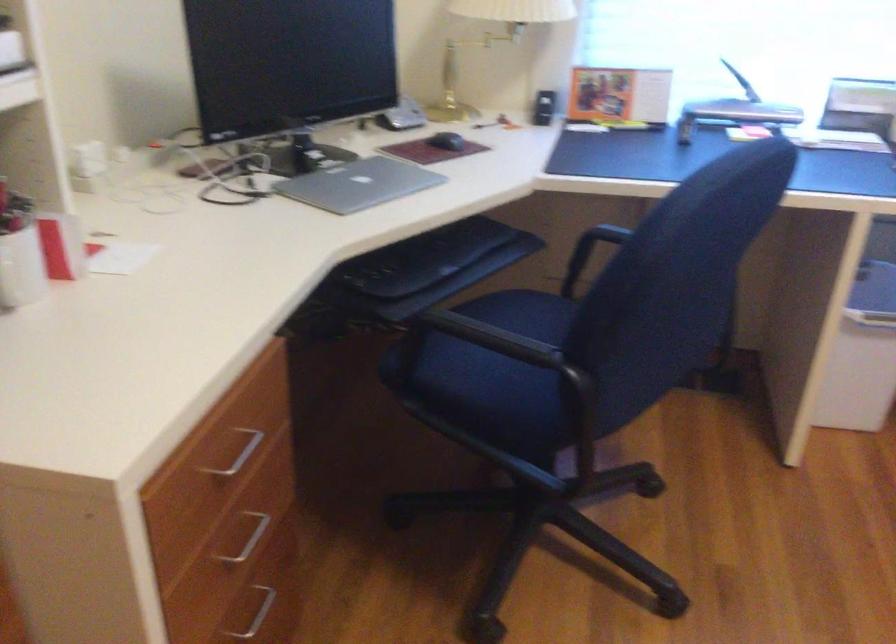
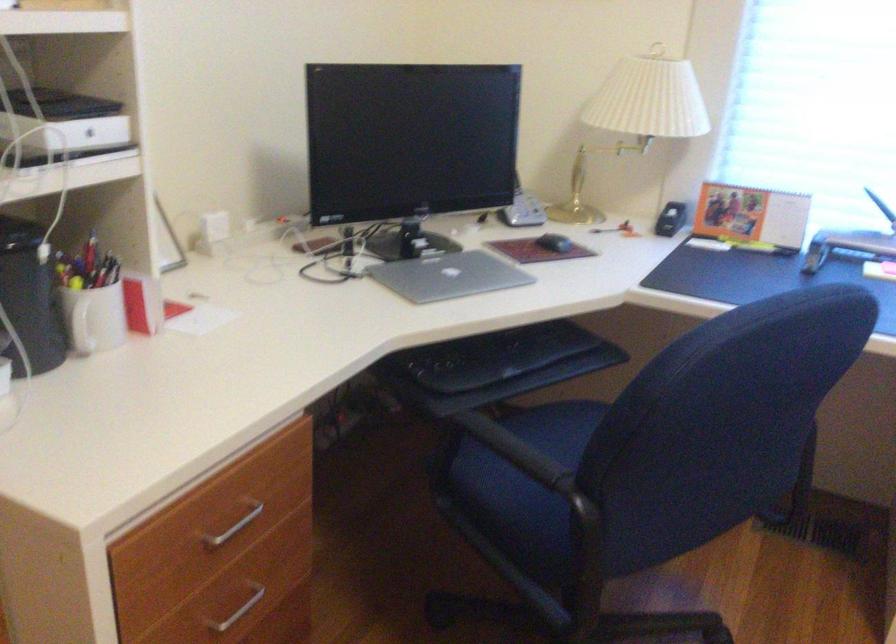
In the second image, find the point that corresponds to point (707, 118) in the first image.

(847, 245)